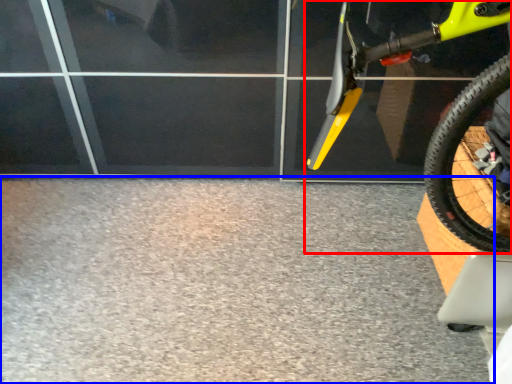
Question: Which object appears farthest to the camera in this image, bicycle (highlighted by a red box) or concrete (highlighted by a blue box)?

Choices:
 (A) bicycle
 (B) concrete

Answer: (B)